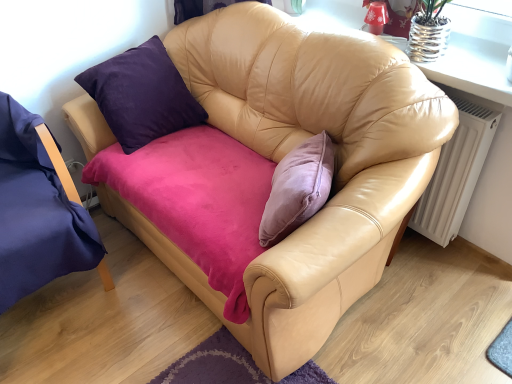
Question: From a real-world perspective, is white matte radiator at right above or below purple fabric chair at left?

Choices:
 (A) below
 (B) above

Answer: (A)

Question: Considering the positions of point (437, 173) and point (5, 301), is point (437, 173) closer or farther from the camera than point (5, 301)?

Choices:
 (A) farther
 (B) closer

Answer: (A)

Question: From the image's perspective, is white matte radiator at right above or below purple fabric chair at left?

Choices:
 (A) above
 (B) below

Answer: (A)

Question: In terms of height, does purple fabric chair at left look taller or shorter compared to white matte radiator at right?

Choices:
 (A) tall
 (B) short

Answer: (A)

Question: Looking at the image, does purple fabric chair at left seem bigger or smaller compared to white matte radiator at right?

Choices:
 (A) small
 (B) big

Answer: (B)

Question: Is point (22, 284) positioned closer to the camera than point (455, 139)?

Choices:
 (A) farther
 (B) closer

Answer: (B)

Question: From the image's perspective, is purple fabric chair at left above or below white matte radiator at right?

Choices:
 (A) above
 (B) below

Answer: (B)